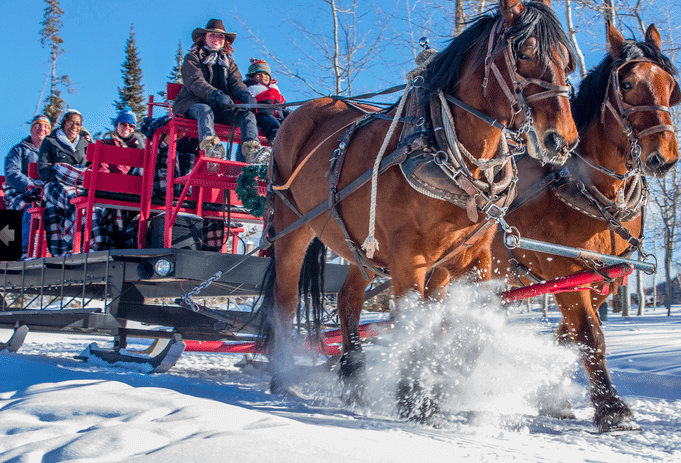
Locate an element on the screen. plaid blanket is located at coordinates (63, 189), (7, 196), (131, 221), (101, 228), (136, 169), (158, 177), (184, 158), (214, 229).